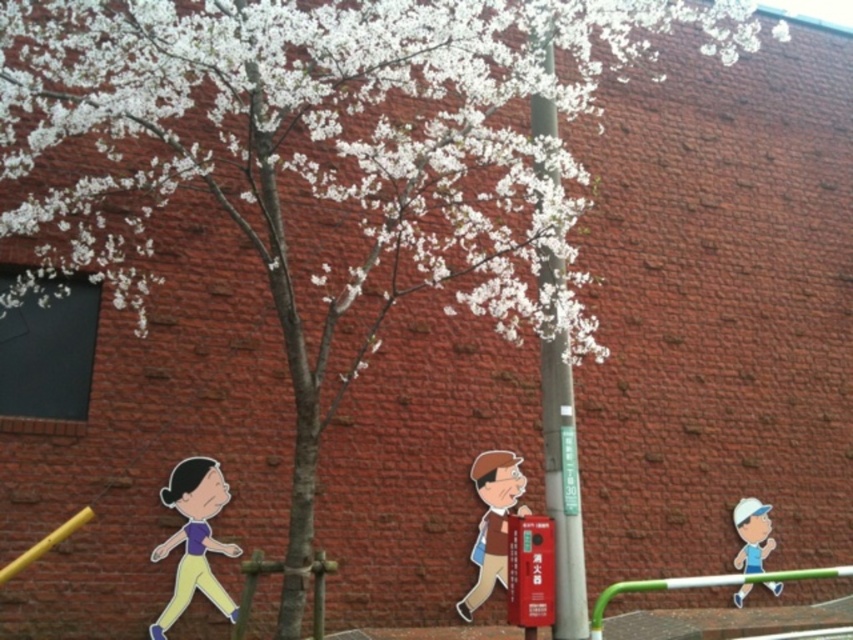
Question: Which of these objects is positioned farthest from the matte blue cap at lower right?

Choices:
 (A) brown paper bag at center
 (B) purple matte shirt at lower left

Answer: (B)

Question: Can you confirm if purple matte shirt at lower left is smaller than matte blue cap at lower right?

Choices:
 (A) no
 (B) yes

Answer: (A)

Question: Is purple matte shirt at lower left positioned behind brown paper bag at center?

Choices:
 (A) yes
 (B) no

Answer: (B)

Question: Which object appears closest to the camera in this image?

Choices:
 (A) matte blue cap at lower right
 (B) brown paper bag at center

Answer: (B)

Question: Which of the following is the farthest from the observer?

Choices:
 (A) (486, 474)
 (B) (183, 508)
 (C) (750, 557)

Answer: (C)

Question: Is purple matte shirt at lower left smaller than brown paper bag at center?

Choices:
 (A) yes
 (B) no

Answer: (A)